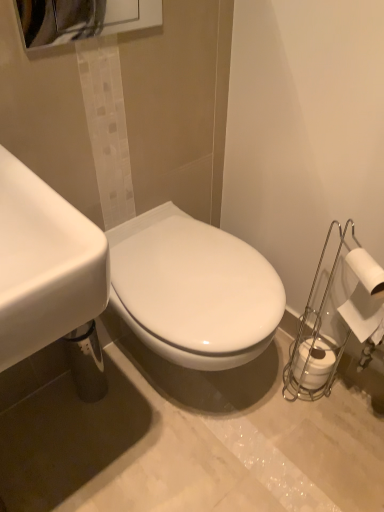
Question: From the image's perspective, does white matte toilet paper at right, the second toilet paper in the bottom-to-top sequence, appear higher than white matte toilet paper at lower right, marked as the first toilet paper in a back-to-front arrangement?

Choices:
 (A) yes
 (B) no

Answer: (A)

Question: Considering the relative sizes of white matte toilet paper at right, the second toilet paper in the bottom-to-top sequence, and white matte toilet paper at lower right, which is the second toilet paper from front to back, in the image provided, is white matte toilet paper at right, the second toilet paper in the bottom-to-top sequence, bigger than white matte toilet paper at lower right, which is the second toilet paper from front to back,?

Choices:
 (A) yes
 (B) no

Answer: (A)

Question: Is white matte toilet paper at right, the 1th toilet paper positioned from the top, at the left side of white matte toilet paper at lower right, which is the second toilet paper from front to back?

Choices:
 (A) no
 (B) yes

Answer: (A)

Question: Is white matte toilet paper at right, the 2th toilet paper positioned from the back, oriented away from white matte toilet paper at lower right, arranged as the second toilet paper when viewed from the top?

Choices:
 (A) no
 (B) yes

Answer: (A)

Question: Is white matte toilet paper at right, the 1th toilet paper positioned from the top, surrounding white matte toilet paper at lower right, placed as the 1th toilet paper when sorted from bottom to top?

Choices:
 (A) no
 (B) yes

Answer: (A)

Question: Considering the positions of white matte toilet paper at right, the 1th toilet paper positioned from the front, and white matte toilet paper at lower right, which is the second toilet paper from front to back, in the image, is white matte toilet paper at right, the 1th toilet paper positioned from the front, wider or thinner than white matte toilet paper at lower right, which is the second toilet paper from front to back,?

Choices:
 (A) wide
 (B) thin

Answer: (B)

Question: From a real-world perspective, relative to white matte toilet paper at lower right, which is the second toilet paper from front to back, is white matte toilet paper at right, the second toilet paper in the bottom-to-top sequence, vertically above or below?

Choices:
 (A) above
 (B) below

Answer: (A)

Question: Is point (365, 322) positioned closer to the camera than point (327, 374)?

Choices:
 (A) farther
 (B) closer

Answer: (B)

Question: Which is correct: white matte toilet paper at right, the 1th toilet paper positioned from the front, is inside white matte toilet paper at lower right, arranged as the second toilet paper when viewed from the top, or outside of it?

Choices:
 (A) inside
 (B) outside

Answer: (B)

Question: Is white glossy sink at left to the left or to the right of white matte toilet paper at lower right, marked as the first toilet paper in a back-to-front arrangement, in the image?

Choices:
 (A) right
 (B) left

Answer: (B)

Question: In the image, is white glossy sink at left positioned in front of or behind white matte toilet paper at lower right, which is the second toilet paper from front to back?

Choices:
 (A) behind
 (B) front

Answer: (B)

Question: Considering the positions of white glossy sink at left and white matte toilet paper at lower right, placed as the 1th toilet paper when sorted from bottom to top, in the image, is white glossy sink at left taller or shorter than white matte toilet paper at lower right, placed as the 1th toilet paper when sorted from bottom to top,?

Choices:
 (A) short
 (B) tall

Answer: (B)

Question: In terms of size, does white glossy sink at left appear bigger or smaller than white matte toilet paper at lower right, marked as the first toilet paper in a back-to-front arrangement?

Choices:
 (A) big
 (B) small

Answer: (A)

Question: From a real-world perspective, is white matte toilet paper at lower right, marked as the first toilet paper in a back-to-front arrangement, physically located above or below white matte toilet paper at right, the 1th toilet paper positioned from the front?

Choices:
 (A) below
 (B) above

Answer: (A)

Question: In terms of width, does white matte toilet paper at lower right, which is the second toilet paper from front to back, look wider or thinner when compared to white matte toilet paper at right, the 1th toilet paper positioned from the top?

Choices:
 (A) thin
 (B) wide

Answer: (B)